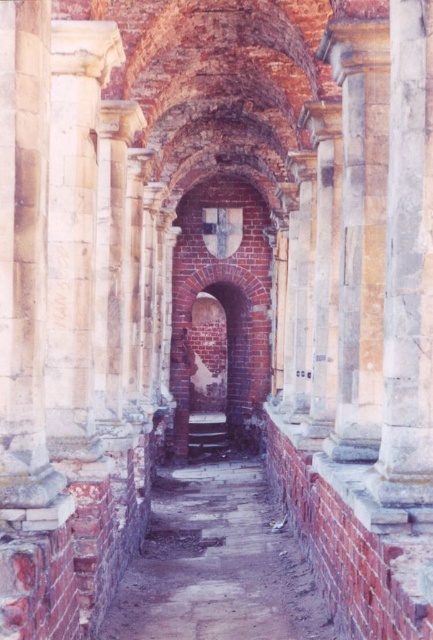
Does brick alley at center have a greater width compared to smooth stone column at right?

Indeed, brick alley at center has a greater width compared to smooth stone column at right.

Is brick alley at center bigger than smooth stone column at right?

Correct, brick alley at center is larger in size than smooth stone column at right.

Between point (245, 458) and point (397, 186), which one is positioned behind?

The point (245, 458) is behind.

The width and height of the screenshot is (433, 640). I want to click on brick alley at center, so click(x=216, y=563).